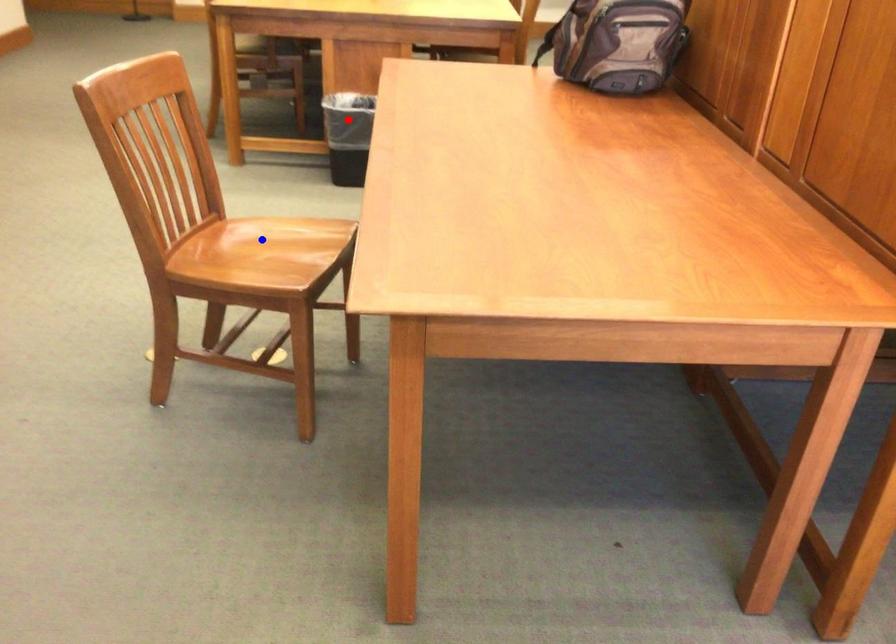
Question: Which of the two points in the image is closer to the camera?

Choices:
 (A) Blue point is closer.
 (B) Red point is closer.

Answer: (A)